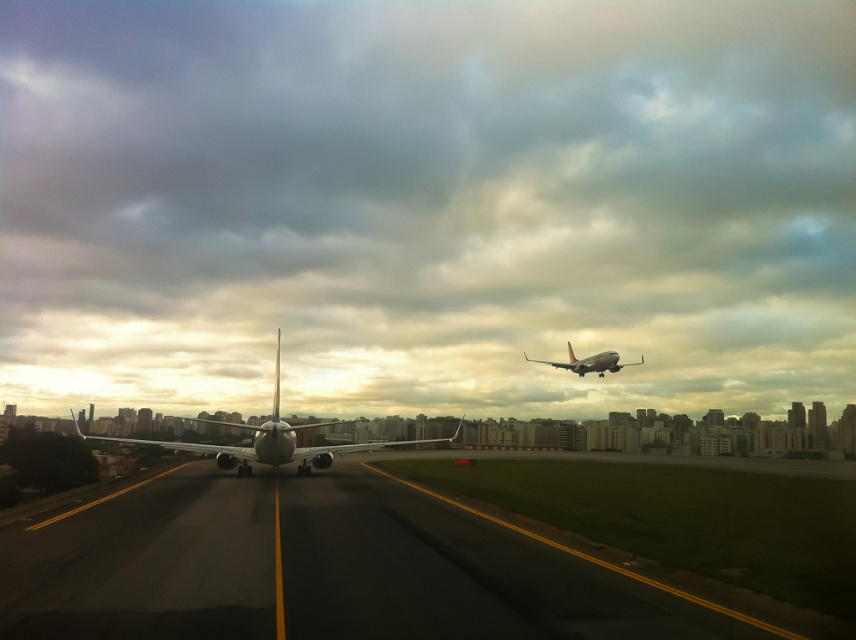
Question: Considering the relative positions of black asphalt tarmac at center and silver metallic airplane at center in the image provided, where is black asphalt tarmac at center located with respect to silver metallic airplane at center?

Choices:
 (A) right
 (B) left

Answer: (A)

Question: Where is black asphalt tarmac at center located in relation to silver metallic airplane at center in the image?

Choices:
 (A) right
 (B) left

Answer: (A)

Question: Which object is farther from the camera taking this photo?

Choices:
 (A) silver metallic airplane at center
 (B) black asphalt tarmac at center

Answer: (A)

Question: Which point is farther to the camera?

Choices:
 (A) (556, 368)
 (B) (150, 483)
 (C) (230, 467)

Answer: (A)

Question: Considering the relative positions of black asphalt tarmac at center and silver metallic airplane at center in the image provided, where is black asphalt tarmac at center located with respect to silver metallic airplane at center?

Choices:
 (A) above
 (B) below

Answer: (A)

Question: Which object is the closest to the silver metallic airplane at center?

Choices:
 (A) black asphalt tarmac at center
 (B) metallic silver airplane at upper right

Answer: (A)